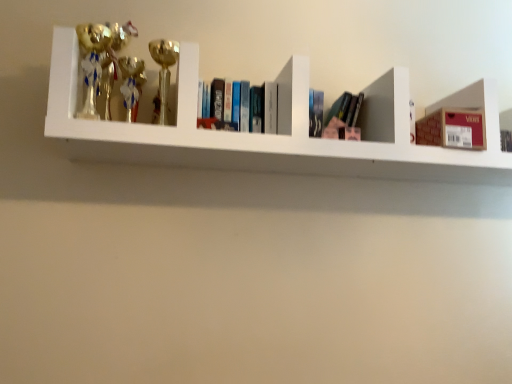
Question: Is gold shiny trophy at left, which is the 1th toy in left-to-right order, inside the boundaries of hardcover books at center, or outside?

Choices:
 (A) inside
 (B) outside

Answer: (B)

Question: In terms of height, does gold shiny trophy at left, which is the 1th toy in left-to-right order, look taller or shorter compared to hardcover books at center?

Choices:
 (A) tall
 (B) short

Answer: (A)

Question: Which object is the closest to the gold shiny trophy at upper left, the second toy viewed from the left?

Choices:
 (A) gold shiny trophy at left, which ranks as the 2th toy in right-to-left order
 (B) hardcover books at center
 (C) metallic trophies at left

Answer: (A)

Question: Considering the real-world distances, which object is closest to the hardcover books at center?

Choices:
 (A) metallic trophies at left
 (B) gold shiny trophy at left, which is the 1th toy in left-to-right order
 (C) gold shiny trophy at upper left, which is the first toy from right to left

Answer: (C)